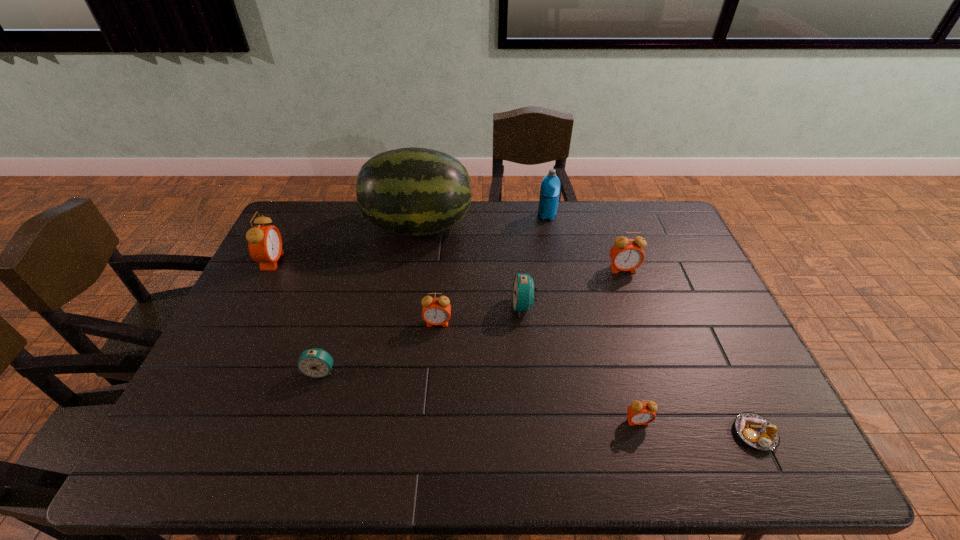
Where is `object located at the left edge`? The height and width of the screenshot is (540, 960). object located at the left edge is located at coordinates (265, 243).

Where is `object positioned at the right edge`? The width and height of the screenshot is (960, 540). object positioned at the right edge is located at coordinates (755, 430).

Identify the location of object positioned at the near right corner. point(755,430).

At what (x,y) coordinates should I click in order to perform the action: click on free location at the far edge. Please return your answer as a coordinate pair (x, y). This screenshot has width=960, height=540. Looking at the image, I should click on (572, 217).

Locate an element on the screen. vacant space at the near edge of the desktop is located at coordinates (568, 461).

In the image, there is a desktop. Identify the location of vacant space at the left edge. Image resolution: width=960 pixels, height=540 pixels. (290, 245).

This screenshot has width=960, height=540. In order to click on vacant region at the right edge in this screenshot , I will do `click(709, 379)`.

In the image, there is a desktop. Where is `vacant space at the far right corner`? The height and width of the screenshot is (540, 960). vacant space at the far right corner is located at coordinates (636, 205).

At what (x,y) coordinates should I click in order to perform the action: click on empty location between the fifth object from left to right and the leftmost object. Please return your answer as a coordinate pair (x, y). This screenshot has width=960, height=540. Looking at the image, I should click on (398, 284).

In order to click on free point between the nearer blue alarm clock and the third biggest pink alarm clock in this screenshot , I will do (379, 347).